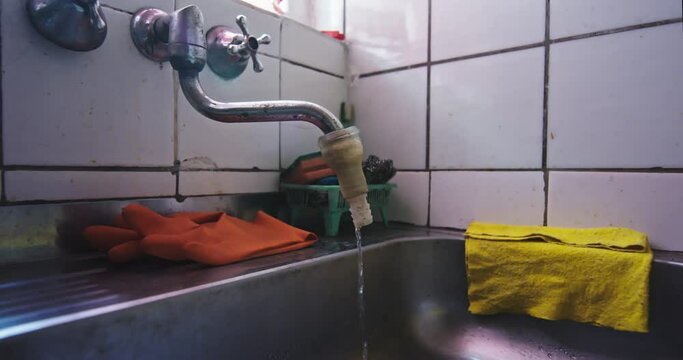
Identify the location of sink. (404, 302).